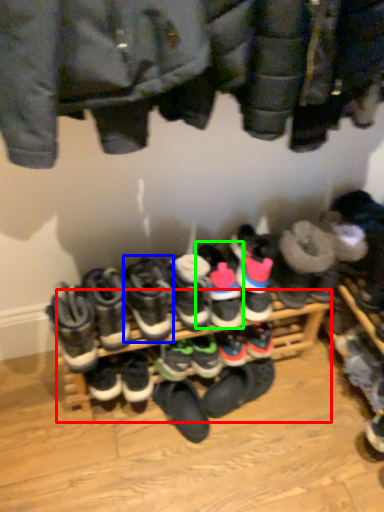
Question: Which is nearer to the shelf (highlighted by a red box)? footwear (highlighted by a blue box) or footwear (highlighted by a green box).

Choices:
 (A) footwear
 (B) footwear

Answer: (A)